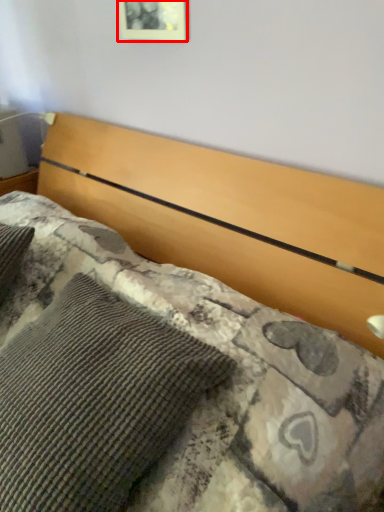
Question: From the image's perspective, considering the relative positions of picture frame (annotated by the red box) and pillow in the image provided, where is picture frame (annotated by the red box) located with respect to the staircase?

Choices:
 (A) above
 (B) below

Answer: (A)